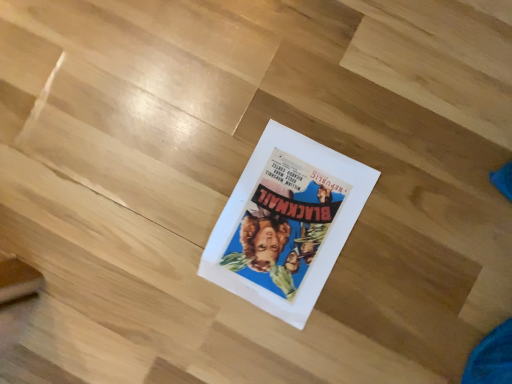
Consider the image. Measure the distance between white paper poster at center and camera.

white paper poster at center is 27.87 inches away from camera.

I want to click on white paper poster at center, so click(x=286, y=223).

The width and height of the screenshot is (512, 384). What do you see at coordinates (286, 223) in the screenshot?
I see `white paper poster at center` at bounding box center [286, 223].

Locate an element on the screen. The image size is (512, 384). white paper poster at center is located at coordinates (286, 223).